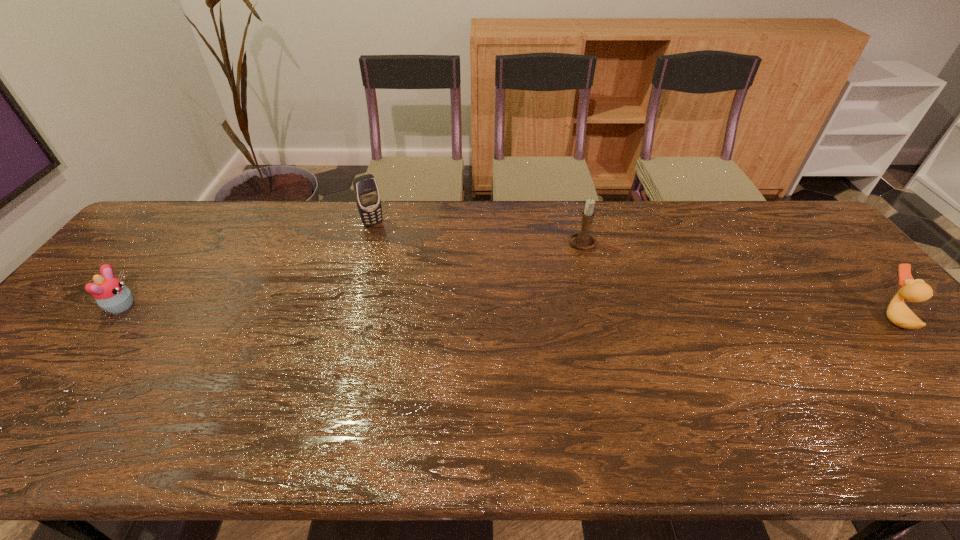
Locate an element on the screen. free space located 0.080m on the side of the second object from right to left with the handle is located at coordinates (551, 259).

I want to click on vacant space located 0.360m on the side of the second object from right to left with the handle, so click(474, 300).

Where is `vacant region located 0.080m on the side of the second object from right to left with the handle`? The width and height of the screenshot is (960, 540). vacant region located 0.080m on the side of the second object from right to left with the handle is located at coordinates (551, 259).

Locate an element on the screen. vacant space situated on the front face of the cellular telephone is located at coordinates (433, 305).

The image size is (960, 540). I want to click on free space located on the front face of the cellular telephone, so (x=403, y=264).

Where is `free region located on the front face of the cellular telephone`? free region located on the front face of the cellular telephone is located at coordinates (388, 242).

Locate an element on the screen. This screenshot has width=960, height=540. candle holder present at the far edge is located at coordinates pyautogui.click(x=582, y=239).

Where is `cellular telephone that is at the far edge`? The height and width of the screenshot is (540, 960). cellular telephone that is at the far edge is located at coordinates [x=367, y=196].

The image size is (960, 540). Identify the location of object that is at the left edge. (111, 294).

Find the location of a particular element. object located in the right edge section of the desktop is located at coordinates (898, 312).